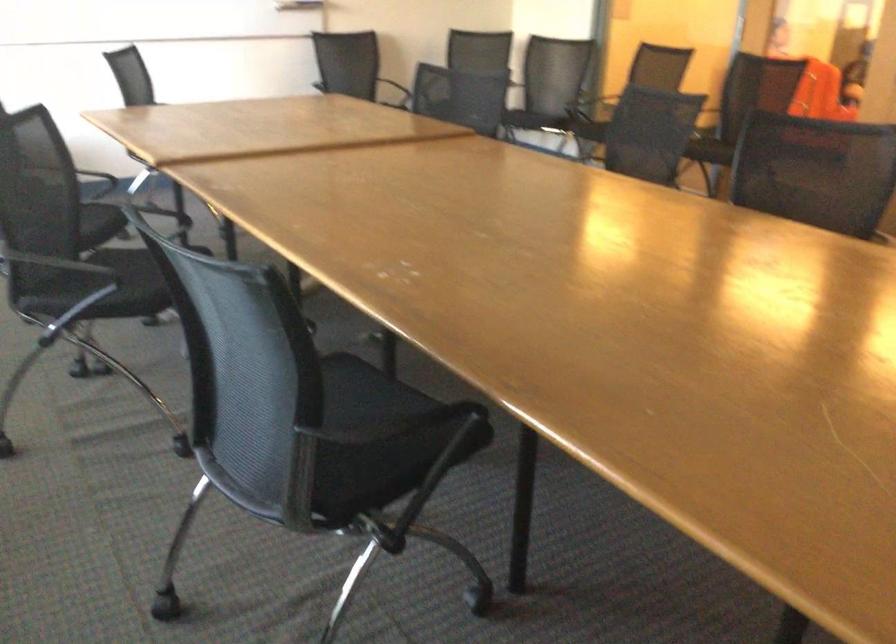
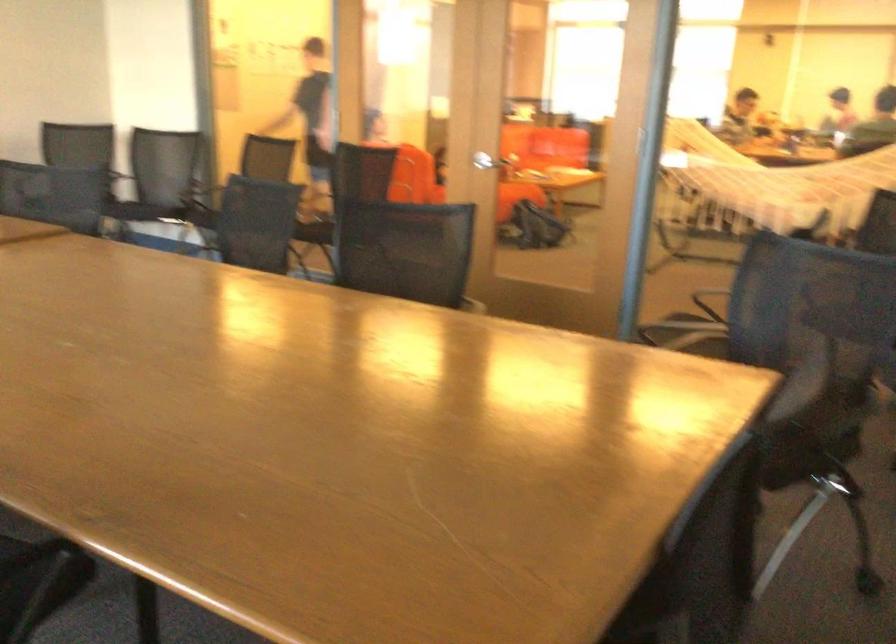
The point at (515,116) is marked in the first image. Where is the corresponding point in the second image?

(141, 211)